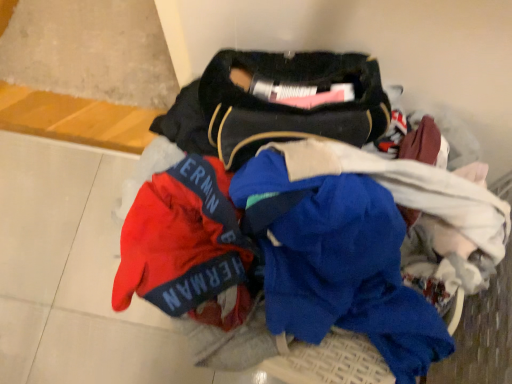
Identify the location of blue fabric at center. (298, 219).

This screenshot has width=512, height=384. What do you see at coordinates (298, 219) in the screenshot?
I see `blue fabric at center` at bounding box center [298, 219].

In order to face blue fabric at center, should I rotate leftwards or rightwards?

Rotate right and turn 15.148 degrees.

Locate an element on the screen. blue fabric at center is located at coordinates (298, 219).